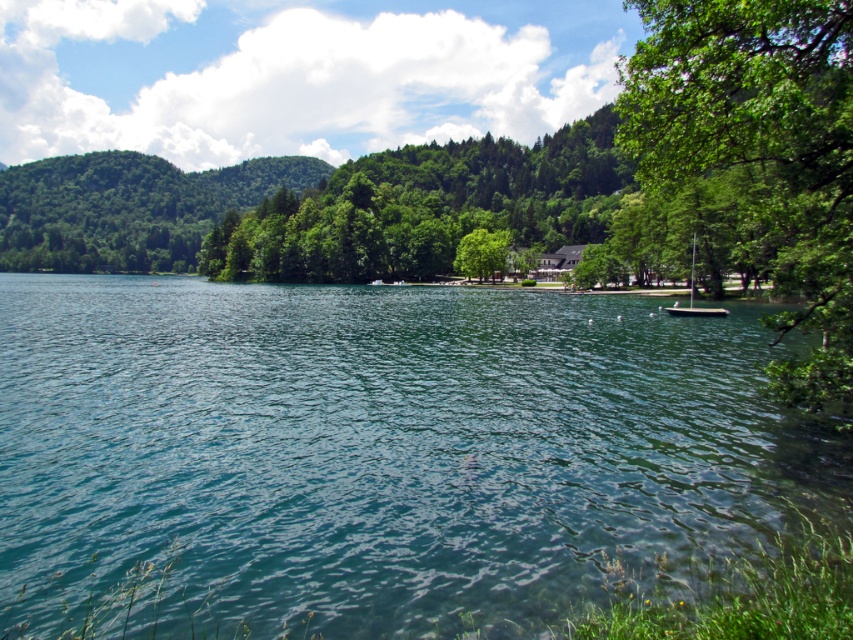
Between point (619, 522) and point (822, 241), which one is positioned behind?

The point (822, 241) is more distant.

Does clear blue water at center appear over green leafy tree at right?

No, clear blue water at center is not above green leafy tree at right.

Locate an element on the screen. Image resolution: width=853 pixels, height=640 pixels. clear blue water at center is located at coordinates (376, 451).

Can you confirm if green leafy tree at right is shorter than green leafy tree at center?

No, green leafy tree at right is not shorter than green leafy tree at center.

Between green leafy tree at right and green leafy tree at center, which one appears on the right side from the viewer's perspective?

Positioned to the right is green leafy tree at right.

Which is in front, point (722, 33) or point (485, 262)?

Point (722, 33) is more forward.

What are the coordinates of `green leafy tree at right` in the screenshot? It's located at (759, 152).

This screenshot has width=853, height=640. What do you see at coordinates (759, 152) in the screenshot?
I see `green leafy tree at right` at bounding box center [759, 152].

Does green leafy tree at right appear on the left side of white plastic boat at right?

Correct, you'll find green leafy tree at right to the left of white plastic boat at right.

Identify the location of green leafy tree at right. The image size is (853, 640). (759, 152).